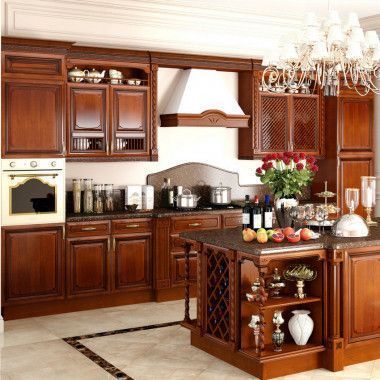
Locate an element on the screen. The image size is (380, 380). jar is located at coordinates (300, 341).